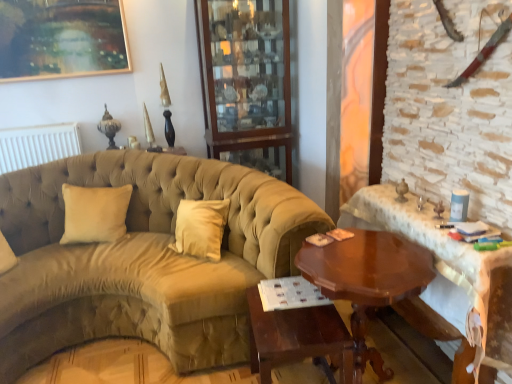
Question: Does suede-like beige couch at center appear on the left side of shiny brown wood table at right, which is counted as the 2th table, starting from the right?

Choices:
 (A) no
 (B) yes

Answer: (B)

Question: Does suede-like beige couch at center have a greater height compared to shiny brown wood table at right, which is counted as the 2th table, starting from the right?

Choices:
 (A) yes
 (B) no

Answer: (A)

Question: Does suede-like beige couch at center lie in front of shiny brown wood table at right, the 2th table in the left-to-right sequence?

Choices:
 (A) no
 (B) yes

Answer: (A)

Question: Does suede-like beige couch at center have a smaller size compared to shiny brown wood table at right, which is counted as the 2th table, starting from the right?

Choices:
 (A) yes
 (B) no

Answer: (B)

Question: Is suede-like beige couch at center oriented away from shiny brown wood table at right, the 2th table in the left-to-right sequence?

Choices:
 (A) yes
 (B) no

Answer: (B)

Question: Are suede-like beige couch at center and shiny brown wood table at right, which is counted as the 2th table, starting from the right, beside each other?

Choices:
 (A) no
 (B) yes

Answer: (A)

Question: From a real-world perspective, is suede-like beige couch at center positioned under beige velvet pillow at left based on gravity?

Choices:
 (A) no
 (B) yes

Answer: (B)

Question: Is the depth of suede-like beige couch at center less than that of beige velvet pillow at left?

Choices:
 (A) yes
 (B) no

Answer: (A)

Question: Is suede-like beige couch at center not inside beige velvet pillow at left?

Choices:
 (A) no
 (B) yes

Answer: (B)

Question: Does suede-like beige couch at center have a larger size compared to beige velvet pillow at left?

Choices:
 (A) no
 (B) yes

Answer: (B)

Question: Can you confirm if suede-like beige couch at center is wider than beige velvet pillow at left?

Choices:
 (A) no
 (B) yes

Answer: (B)

Question: Considering the relative sizes of suede-like beige couch at center and beige velvet pillow at left in the image provided, is suede-like beige couch at center shorter than beige velvet pillow at left?

Choices:
 (A) yes
 (B) no

Answer: (B)

Question: Does shiny brown wood table at right, the 2th table in the left-to-right sequence, have a greater width compared to suede-like beige couch at center?

Choices:
 (A) yes
 (B) no

Answer: (B)